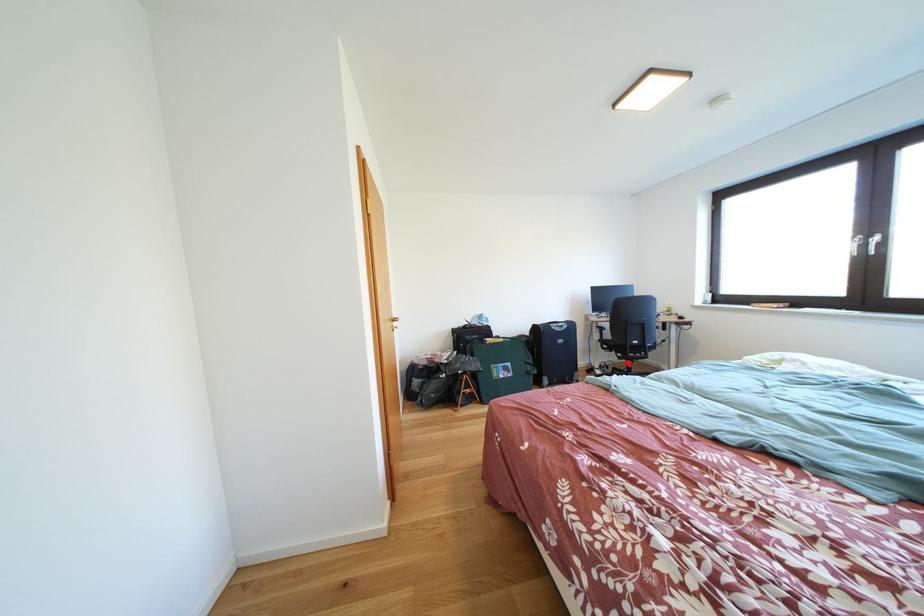
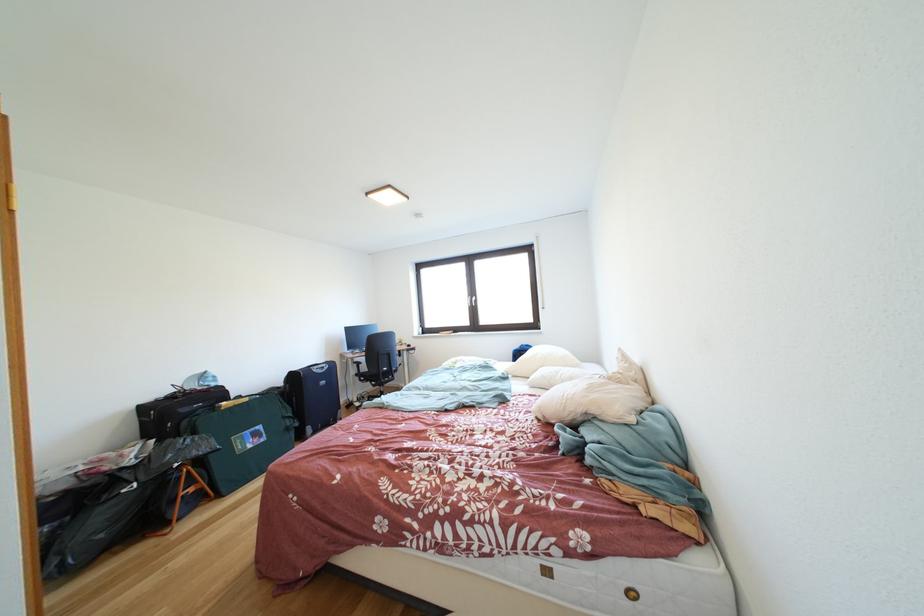
Locate, in the second image, the point that corresponds to the highlighted location in the first image.

(383, 391)